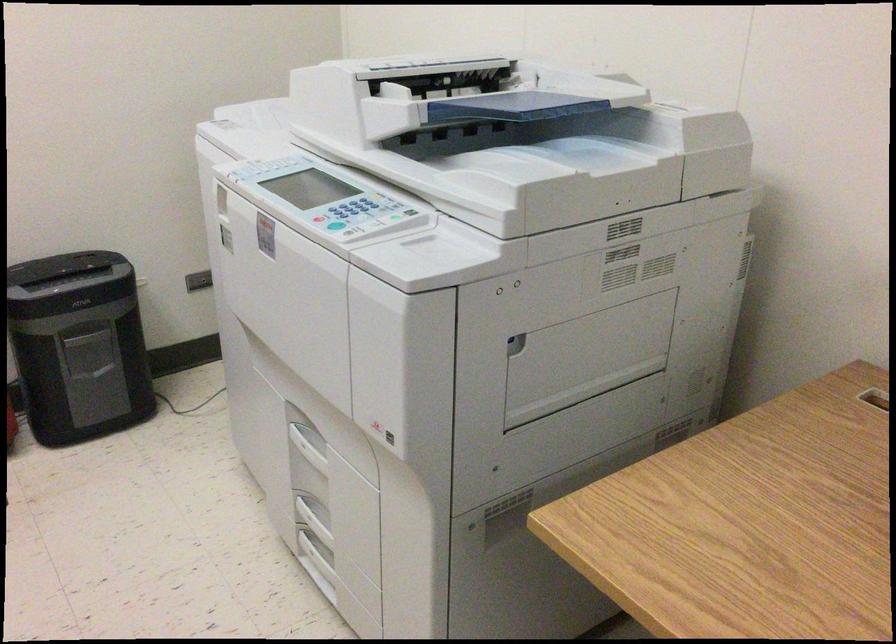
Where is `paper shredder slot`? paper shredder slot is located at coordinates (589, 348).